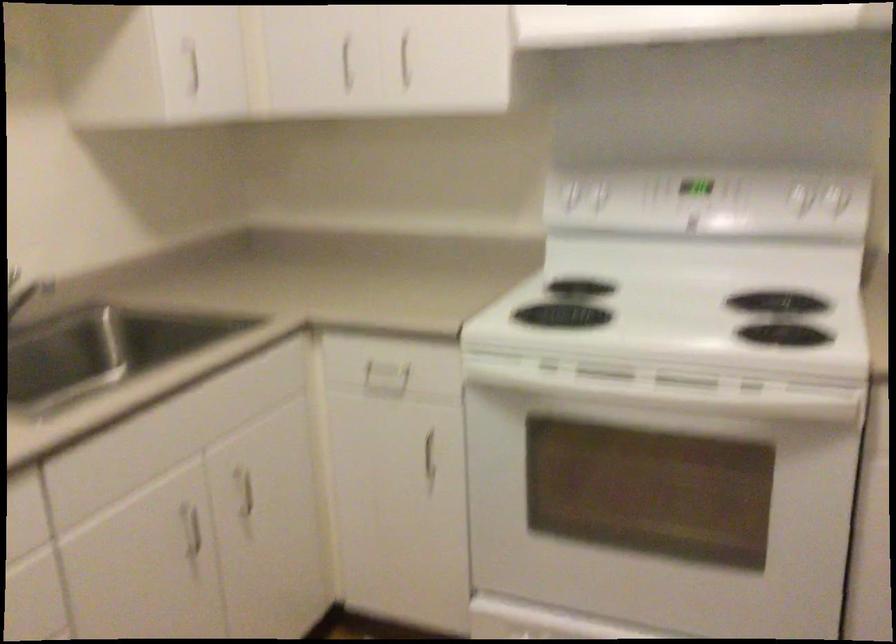
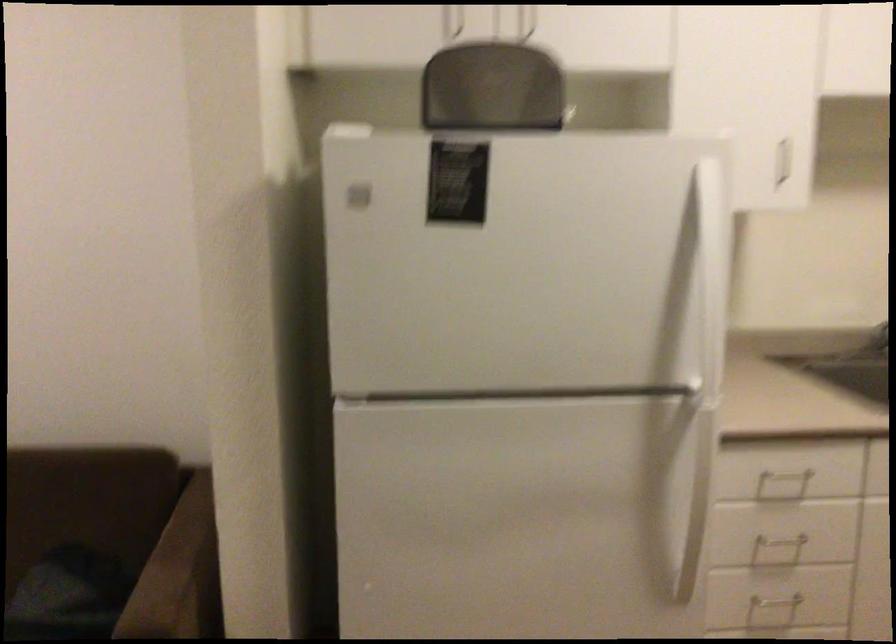
Question: The camera is either moving clockwise (left) or counter-clockwise (right) around the object. The first image is from the beginning of the video and the second image is from the end. Is the camera moving left or right when shooting the video?

Choices:
 (A) Left
 (B) Right

Answer: (B)